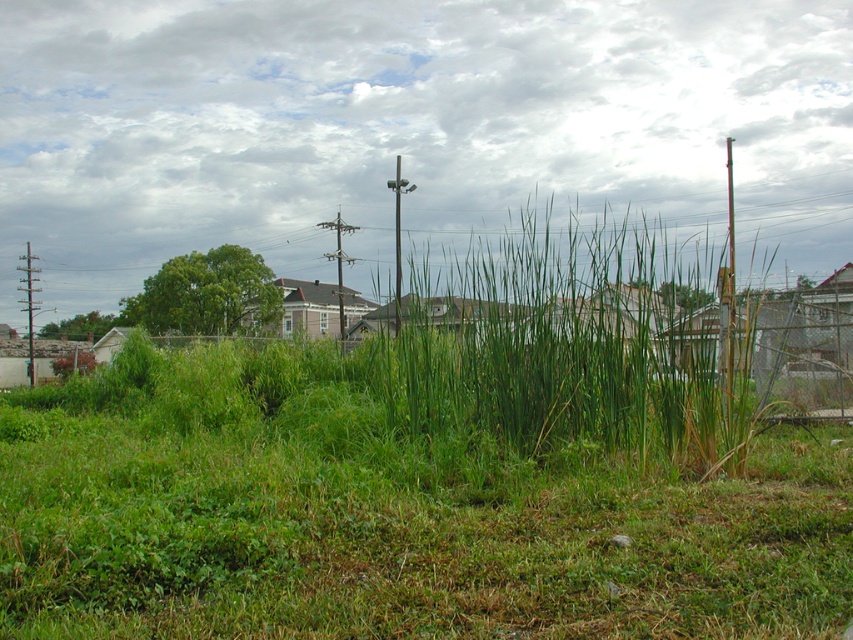
Question: Which object is the farthest from the brown wooden telegraph pole at center?

Choices:
 (A) metallic gray telegraph pole at left
 (B) metallic gray pole at center

Answer: (A)

Question: Which point appears closest to the camera in this image?

Choices:
 (A) (393, 225)
 (B) (28, 374)

Answer: (B)

Question: Considering the real-world distances, which object is closest to the metallic gray telegraph pole at left?

Choices:
 (A) brown wooden telegraph pole at center
 (B) metallic gray pole at center

Answer: (A)

Question: Where is metallic gray pole at center located in relation to brown wooden telegraph pole at center in the image?

Choices:
 (A) right
 (B) left

Answer: (A)

Question: Is metallic gray telegraph pole at left to the left of brown wooden telegraph pole at center from the viewer's perspective?

Choices:
 (A) no
 (B) yes

Answer: (B)

Question: Is metallic gray telegraph pole at left positioned at the back of metallic gray pole at center?

Choices:
 (A) no
 (B) yes

Answer: (B)